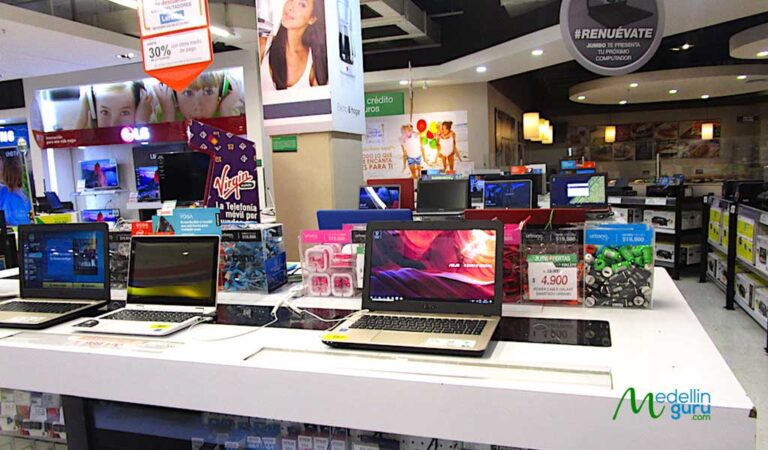
Locate an element on the screen. The width and height of the screenshot is (768, 450). laptop is located at coordinates (44, 316).